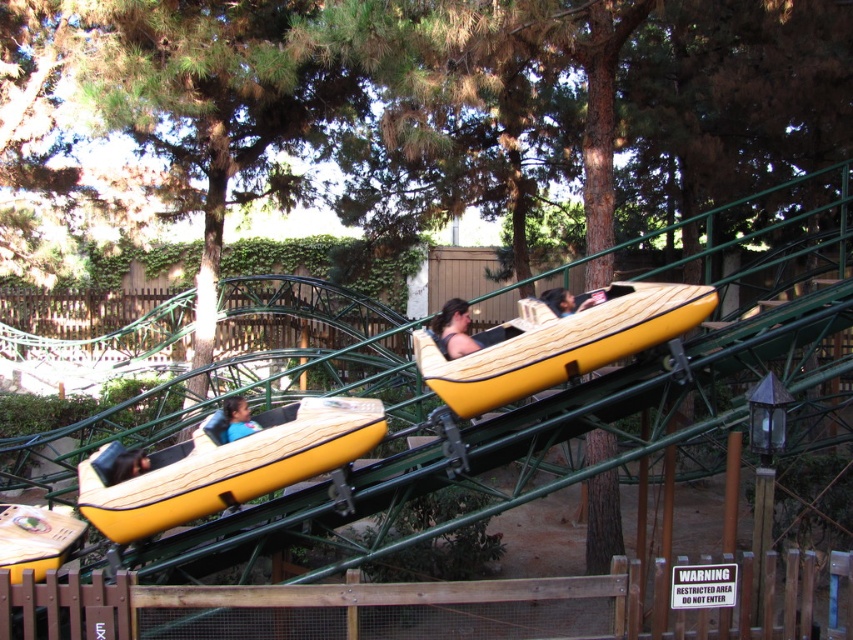
You are a safety inspector checking the distance between the wooden raft at center and the smooth tan helmet at center. According to the safety regulations, the minimum required distance between any two objects on the track is 1.05 meters. Is the current distance compliant with the regulation?

The wooden raft at center and smooth tan helmet at center are 1.06 meters apart from each other, which is just above the minimum required distance of 1.05 meters. Therefore, the current distance is compliant with the safety regulation.

You are a safety inspector checking the roller coaster track. You need to inspect two points on the track, point 1 at coordinate (300, 440) and point 2 at coordinate (453, 307). Which point is closer to you?

Point 1 at coordinate (300, 440) is closer to the viewer than point 2 at coordinate (453, 307).

You are a safety inspector checking the roller coaster. You notice the matte yellow raft at left and the matte brown hair at center. According to the safety guidelines, the raft must not block the view of the hair for monitoring purposes. Is the current arrangement compliant?

The matte yellow raft at left is in front of the matte brown hair at center, which means it is blocking the view of the matte brown hair at center. This violates the safety guidelines, so the arrangement is not compliant.